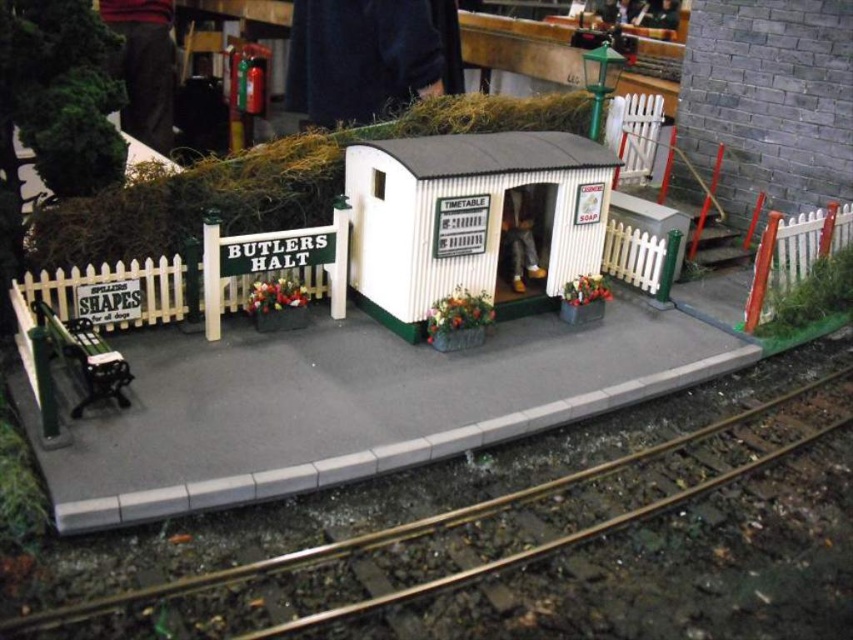
You are a passenger waiting at Butler Halt railway station. You see the white corrugated metal hut at center and the metallic gold track at lower center. Which object is closer to the right side of the track?

The white corrugated metal hut at center is positioned on the right side of metallic gold track at lower center, so it is closer to the right side of the track.

You are a railway engineer inspecting the model railway station. You need to determine if the white corrugated metal hut at center can be placed on the metallic gold track at lower center without exceeding the track width. Can it fit based on their dimensions?

The white corrugated metal hut at center is wider than the metallic gold track at lower center, so it cannot fit on the track without exceeding its width.

You are standing at the point with coordinates (473,221) on the platform of Butler Halt railway station. What structure are you currently on?

The point with coordinates (473,221) is on the white corrugated metal hut at center, so you are currently on the white corrugated metal hut at center.